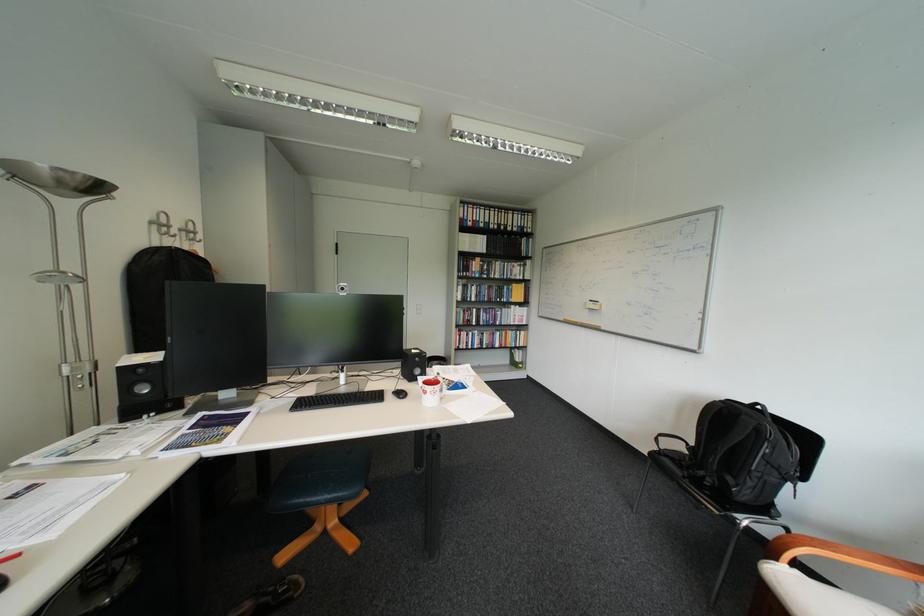
The image size is (924, 616). Describe the element at coordinates (809, 593) in the screenshot. I see `the white chair sitting surface` at that location.